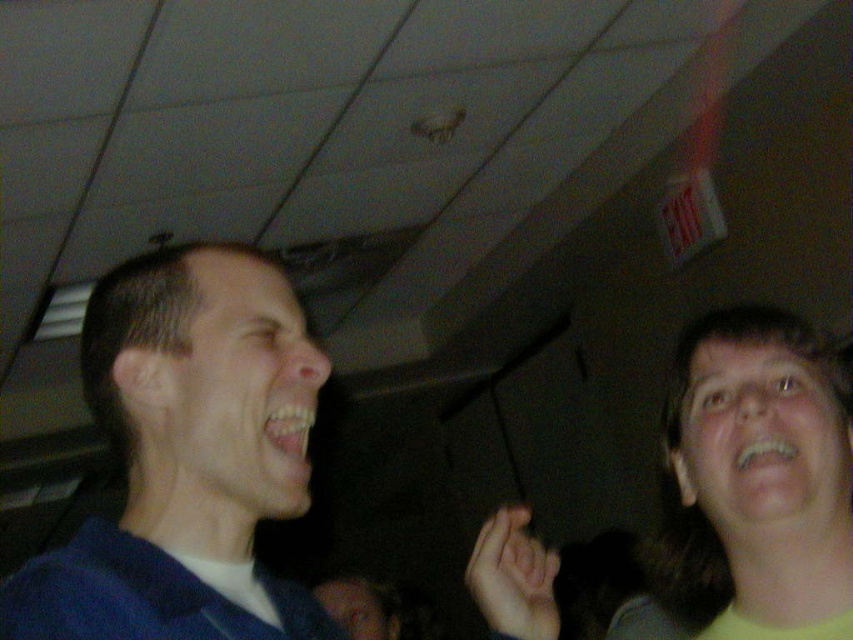
Question: In this image, where is blue fabric shirt at left located relative to yellow matte face at upper right?

Choices:
 (A) below
 (B) above

Answer: (B)

Question: Can you confirm if yellow matte face at upper right is positioned to the left of smooth skin hand at lower right?

Choices:
 (A) yes
 (B) no

Answer: (B)

Question: Which object is farther from the camera taking this photo?

Choices:
 (A) blue fabric shirt at left
 (B) yellow matte face at upper right
 (C) smooth skin hand at lower right

Answer: (C)

Question: Which of the following is the closest to the observer?

Choices:
 (A) (250, 424)
 (B) (685, 408)
 (C) (488, 582)

Answer: (A)

Question: Estimate the real-world distances between objects in this image. Which object is closer to the blue fabric shirt at left?

Choices:
 (A) yellow matte face at upper right
 (B) smooth skin hand at lower right

Answer: (B)

Question: Does blue fabric shirt at left appear on the right side of yellow matte face at upper right?

Choices:
 (A) no
 (B) yes

Answer: (A)